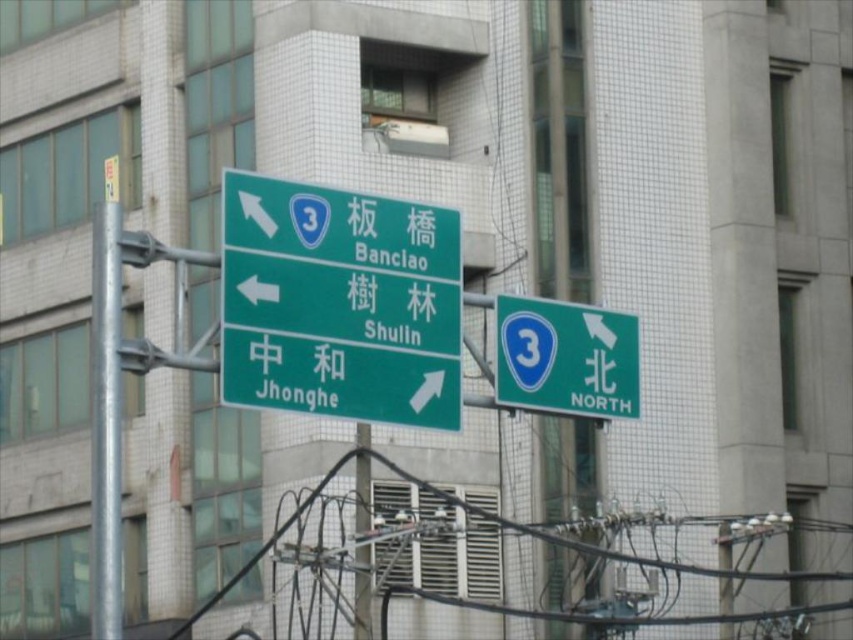
Between green glossy signboard at upper center and green glossy signboard at center, which one appears on the right side from the viewer's perspective?

green glossy signboard at center

Is point (242, 212) less distant than point (349, 324)?

Yes.

Which is in front, point (280, 387) or point (265, 323)?

Point (265, 323) is more forward.

Where is `green glossy signboard at upper center`? The image size is (853, 640). green glossy signboard at upper center is located at coordinates (339, 301).

Between green glossy signboard at upper center and metallic pole at center, which one is positioned higher?

green glossy signboard at upper center

Which is below, green glossy signboard at upper center or metallic pole at center?

metallic pole at center is below.

Locate an element on the screen. green glossy signboard at upper center is located at coordinates (339, 301).

Who is more distant from viewer, (241, 253) or (357, 580)?

Point (357, 580)

Can you confirm if green glossy signboard at center is wider than metallic pole at center?

Yes, green glossy signboard at center is wider than metallic pole at center.

Which is behind, point (343, 320) or point (358, 458)?

Point (358, 458)

Where is `green glossy signboard at center`? The width and height of the screenshot is (853, 640). green glossy signboard at center is located at coordinates [x=339, y=301].